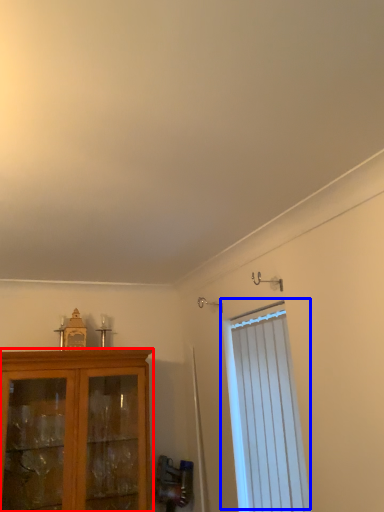
Question: Which of the following is the farthest to the observer, cabinetry (highlighted by a red box) or window (highlighted by a blue box)?

Choices:
 (A) cabinetry
 (B) window

Answer: (A)